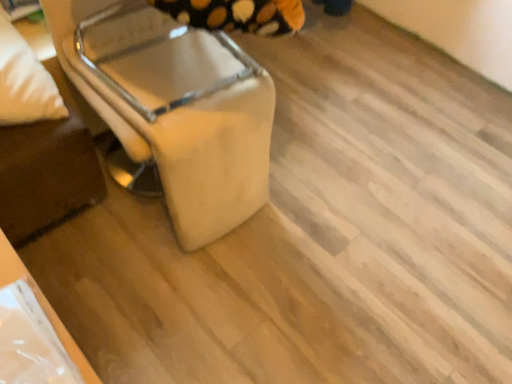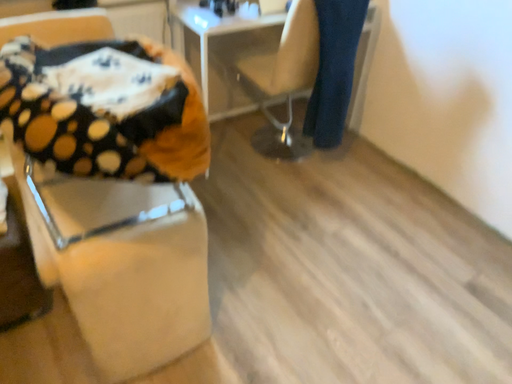
Question: Which way did the camera rotate in the video?

Choices:
 (A) rotated right
 (B) rotated left

Answer: (B)